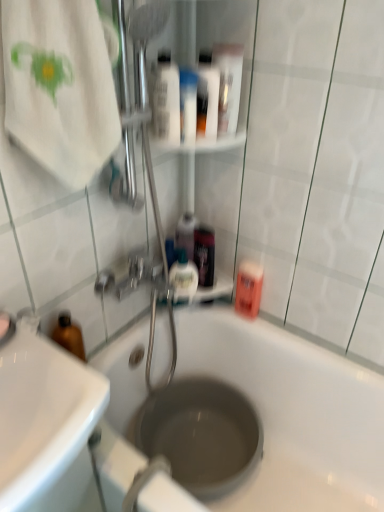
Question: Considering the relative sizes of pink matte mouthwash at right, marked as the 1th mouthwash in a bottom-to-top arrangement, and white glossy mouthwash at upper center, which appears as the first mouthwash when viewed from the top, in the image provided, is pink matte mouthwash at right, marked as the 1th mouthwash in a bottom-to-top arrangement, wider than white glossy mouthwash at upper center, which appears as the first mouthwash when viewed from the top,?

Choices:
 (A) yes
 (B) no

Answer: (B)

Question: Does pink matte mouthwash at right, the 7th mouthwash viewed from the top, come in front of white glossy mouthwash at upper center, the 7th mouthwash when ordered from bottom to top?

Choices:
 (A) yes
 (B) no

Answer: (B)

Question: Is pink matte mouthwash at right, marked as the 1th mouthwash in a bottom-to-top arrangement, thinner than white glossy mouthwash at upper center, which appears as the first mouthwash when viewed from the top?

Choices:
 (A) no
 (B) yes

Answer: (B)

Question: Is white glossy mouthwash at upper center, the 7th mouthwash when ordered from bottom to top, surrounded by pink matte mouthwash at right, marked as the 1th mouthwash in a bottom-to-top arrangement?

Choices:
 (A) yes
 (B) no

Answer: (B)

Question: From a real-world perspective, is pink matte mouthwash at right, marked as the 1th mouthwash in a bottom-to-top arrangement, over white glossy mouthwash at upper center, the 7th mouthwash when ordered from bottom to top?

Choices:
 (A) no
 (B) yes

Answer: (A)

Question: From a real-world perspective, is pink matte mouthwash at right, marked as the 1th mouthwash in a bottom-to-top arrangement, located beneath white glossy mouthwash at upper center, the 7th mouthwash when ordered from bottom to top?

Choices:
 (A) no
 (B) yes

Answer: (B)

Question: Is translucent plastic mouthwash at upper center, arranged as the 3th mouthwash when viewed from the top, at the back of translucent plastic mouthwash at upper center, which appears as the second mouthwash when ordered from the bottom?

Choices:
 (A) yes
 (B) no

Answer: (B)

Question: Is translucent plastic mouthwash at upper center, which ranks as the 5th mouthwash in bottom-to-top order, located within translucent plastic mouthwash at upper center, which appears as the sixth mouthwash when viewed from the top?

Choices:
 (A) yes
 (B) no

Answer: (B)

Question: From the image's perspective, is translucent plastic mouthwash at upper center, which appears as the sixth mouthwash when viewed from the top, above translucent plastic mouthwash at upper center, which ranks as the 5th mouthwash in bottom-to-top order?

Choices:
 (A) yes
 (B) no

Answer: (B)

Question: Is translucent plastic mouthwash at upper center, which appears as the second mouthwash when ordered from the bottom, to the left of translucent plastic mouthwash at upper center, arranged as the 3th mouthwash when viewed from the top, from the viewer's perspective?

Choices:
 (A) yes
 (B) no

Answer: (B)

Question: Does translucent plastic mouthwash at upper center, which appears as the second mouthwash when ordered from the bottom, have a lesser width compared to translucent plastic mouthwash at upper center, arranged as the 3th mouthwash when viewed from the top?

Choices:
 (A) yes
 (B) no

Answer: (A)

Question: Is translucent plastic mouthwash at upper center, which appears as the sixth mouthwash when viewed from the top, aimed at translucent plastic mouthwash at upper center, which ranks as the 5th mouthwash in bottom-to-top order?

Choices:
 (A) yes
 (B) no

Answer: (B)

Question: Does translucent plastic mouthwash at upper center, which ranks as the 5th mouthwash in bottom-to-top order, have a lesser height compared to white glossy tube at upper center?

Choices:
 (A) no
 (B) yes

Answer: (A)